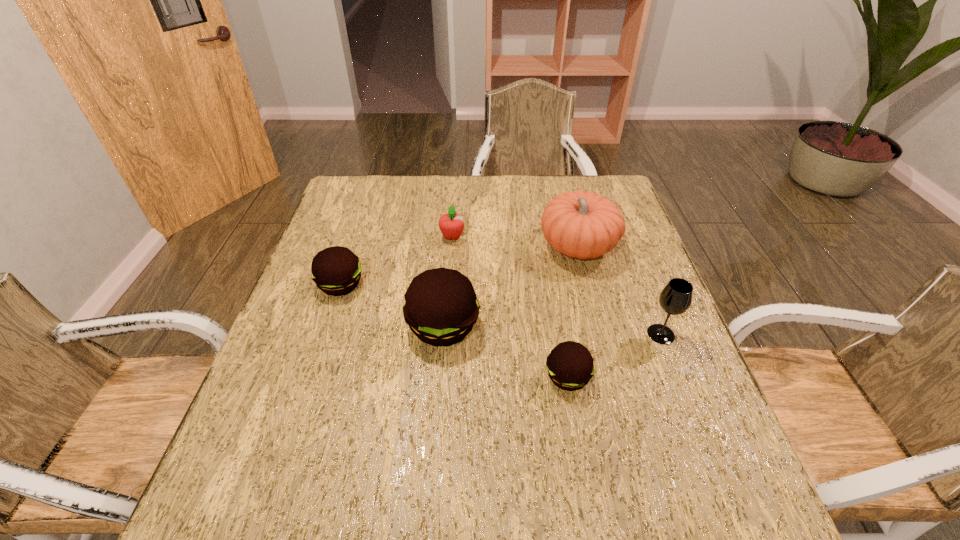
Locate an element on the screen. This screenshot has width=960, height=540. free region at the right edge is located at coordinates (x=651, y=340).

The width and height of the screenshot is (960, 540). In the image, there is a desktop. In order to click on free region at the far left corner in this screenshot , I will do `click(372, 193)`.

Locate an element on the screen. This screenshot has width=960, height=540. vacant region at the near right corner of the desktop is located at coordinates (673, 460).

Find the location of a particular element. The image size is (960, 540). vacant point located between the wineglass and the tallest patty is located at coordinates (552, 330).

Locate an element on the screen. This screenshot has height=540, width=960. empty space that is in between the tallest patty and the wineglass is located at coordinates (552, 330).

Where is `free space between the second tallest patty and the apple`? free space between the second tallest patty and the apple is located at coordinates (396, 260).

Where is `empty space that is in between the wineglass and the leftmost object`? The height and width of the screenshot is (540, 960). empty space that is in between the wineglass and the leftmost object is located at coordinates (501, 309).

This screenshot has height=540, width=960. I want to click on free spot between the tallest patty and the leftmost object, so pyautogui.click(x=392, y=305).

Locate an element on the screen. The height and width of the screenshot is (540, 960). free spot between the nearest patty and the apple is located at coordinates (510, 307).

Where is `vacant area between the second patty from right to left and the leftmost object`? vacant area between the second patty from right to left and the leftmost object is located at coordinates (392, 305).